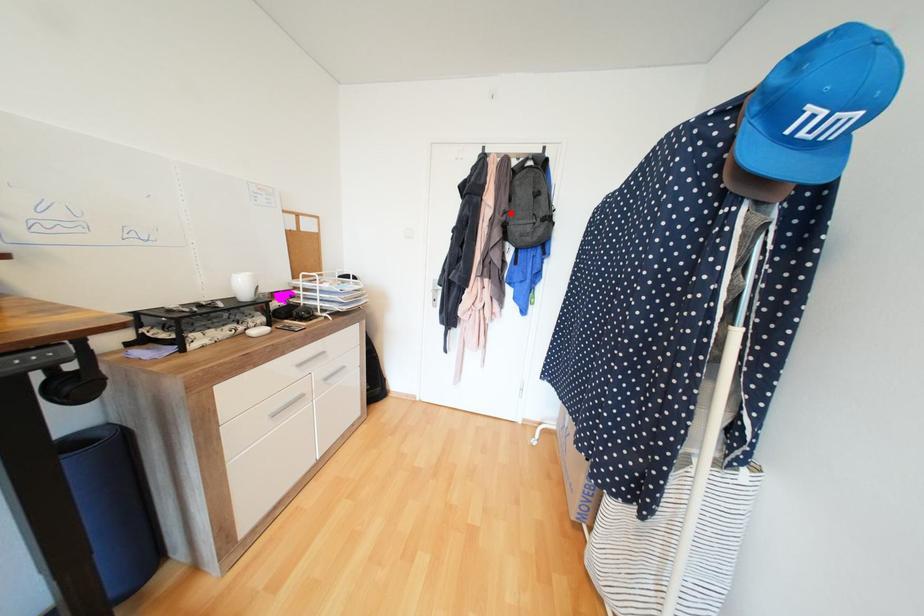
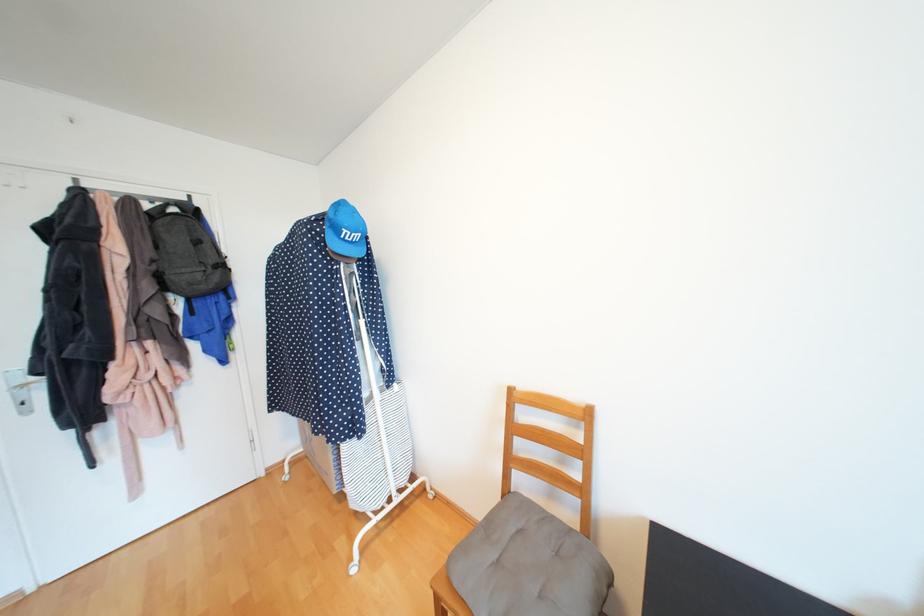
Where in the second image is the point corresponding to the highlighted location from the first image?

(160, 262)